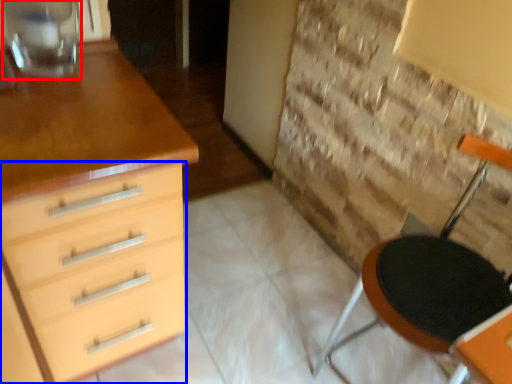
Question: Among these objects, which one is nearest to the camera, glass vase (highlighted by a red box) or chest of drawers (highlighted by a blue box)?

Choices:
 (A) glass vase
 (B) chest of drawers

Answer: (B)